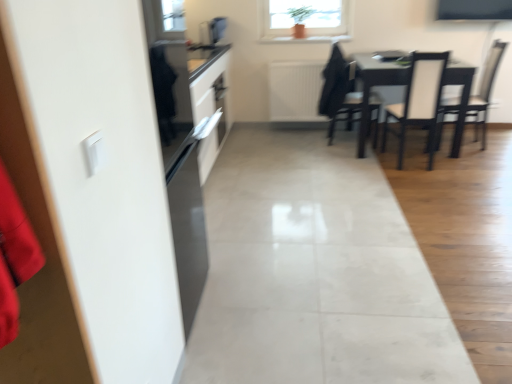
Question: Considering the positions of point (459, 96) and point (212, 31), is point (459, 96) closer or farther from the camera than point (212, 31)?

Choices:
 (A) farther
 (B) closer

Answer: (B)

Question: Considering the positions of white leather chair at right, the third chair from the left, and satin black microwave at upper center in the image, is white leather chair at right, the third chair from the left, wider or thinner than satin black microwave at upper center?

Choices:
 (A) wide
 (B) thin

Answer: (A)

Question: Which of these objects is positioned farthest from the black matte sweatshirt at upper center?

Choices:
 (A) white leather chair at right, the third chair from the left
 (B) white leather chair at center, the second chair positioned from the right
 (C) satin black microwave at upper center
 (D) white textured radiator at center
 (E) dark wood chair at center, arranged as the third chair when viewed from the right

Answer: (C)

Question: Which of these objects is positioned farthest from the white leather chair at right, the third chair from the left?

Choices:
 (A) white textured radiator at center
 (B) dark wood chair at center, arranged as the 1th chair when viewed from the left
 (C) satin black microwave at upper center
 (D) black matte sweatshirt at upper center
 (E) white leather chair at center, the second chair positioned from the right

Answer: (C)